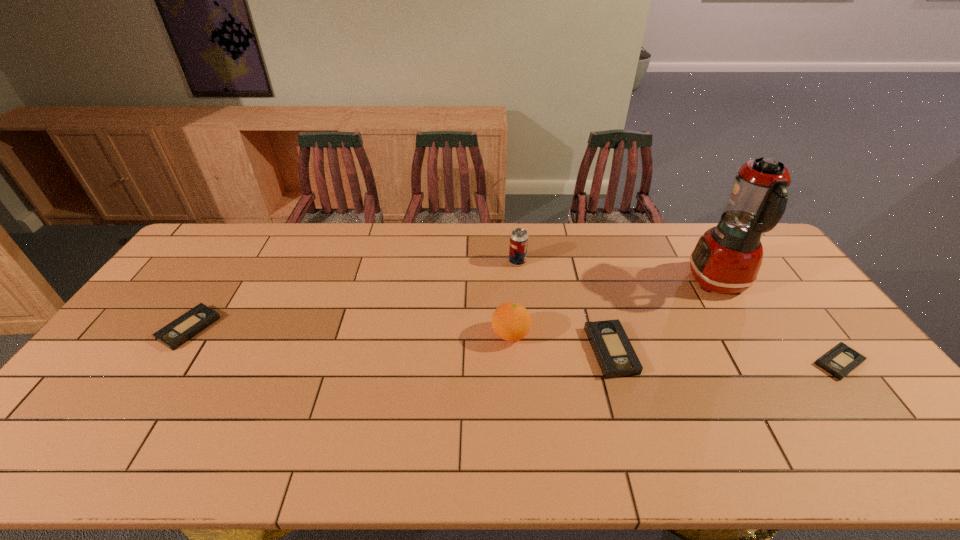
Locate an element on the screen. vacant position for inserting another videotape evenly is located at coordinates (395, 339).